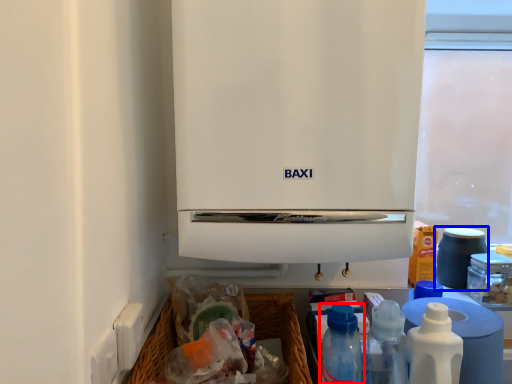
Question: Which point is closer to the camera, bottle (highlighted by a red box) or appliance (highlighted by a blue box)?

Choices:
 (A) bottle
 (B) appliance

Answer: (A)